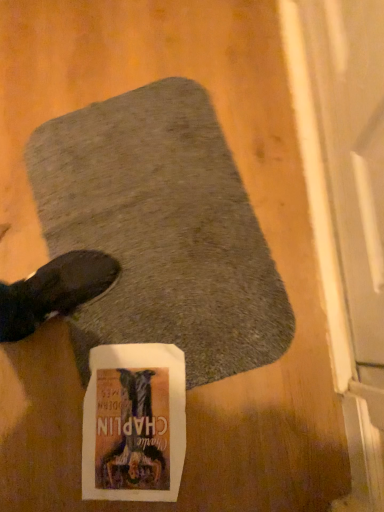
This screenshot has height=512, width=384. Describe the element at coordinates (161, 230) in the screenshot. I see `gray soft rug at center` at that location.

Locate an element on the screen. Image resolution: width=384 pixels, height=512 pixels. gray soft rug at center is located at coordinates (161, 230).

The image size is (384, 512). Find the location of `white paper flyer at center`. white paper flyer at center is located at coordinates pyautogui.click(x=134, y=423).

What do you see at coordinates (134, 423) in the screenshot? I see `white paper flyer at center` at bounding box center [134, 423].

The height and width of the screenshot is (512, 384). I want to click on gray soft rug at center, so click(x=161, y=230).

In the scene shown: Which object is positioned more to the right, gray soft rug at center or white paper flyer at center?

From the viewer's perspective, gray soft rug at center appears more on the right side.

Does gray soft rug at center come behind white paper flyer at center?

No, gray soft rug at center is in front of white paper flyer at center.

Is point (244, 340) in front of point (161, 445)?

That is False.

From the image's perspective, would you say gray soft rug at center is shown under white paper flyer at center?

Incorrect, from the image's perspective, gray soft rug at center is higher than white paper flyer at center.

From a real-world perspective, relative to white paper flyer at center, is gray soft rug at center vertically above or below?

gray soft rug at center is above white paper flyer at center.

Can you confirm if gray soft rug at center is wider than white paper flyer at center?

Yes, gray soft rug at center is wider than white paper flyer at center.

Considering the sizes of objects gray soft rug at center and white paper flyer at center in the image provided, who is shorter, gray soft rug at center or white paper flyer at center?

Standing shorter between the two is white paper flyer at center.

In terms of size, does gray soft rug at center appear bigger or smaller than white paper flyer at center?

Considering their sizes, gray soft rug at center takes up more space than white paper flyer at center.

Would you say gray soft rug at center is outside white paper flyer at center?

gray soft rug at center is positioned outside white paper flyer at center.

Is gray soft rug at center with white paper flyer at center?

gray soft rug at center and white paper flyer at center are clearly separated.

Does gray soft rug at center turn towards white paper flyer at center?

No.

How many degrees apart are the facing directions of gray soft rug at center and white paper flyer at center?

There is a 105-degree angle between the facing directions of gray soft rug at center and white paper flyer at center.

Locate an element on the screen. The image size is (384, 512). mat above the white paper flyer at center (from the image's perspective) is located at coordinates (161, 230).

Which is more to the right, white paper flyer at center or gray soft rug at center?

Positioned to the right is gray soft rug at center.

Considering the relative positions of white paper flyer at center and gray soft rug at center in the image provided, is white paper flyer at center behind gray soft rug at center?

Yes, it is behind gray soft rug at center.

Is point (117, 487) farther from viewer compared to point (254, 280)?

No, (117, 487) is closer to viewer.

From the image's perspective, is white paper flyer at center on top of gray soft rug at center?

No, from the image's perspective, white paper flyer at center is not above gray soft rug at center.

From a real-world perspective, which is physically above, white paper flyer at center or gray soft rug at center?

From a 3D spatial view, gray soft rug at center is above.

Which object is thinner, white paper flyer at center or gray soft rug at center?

Thinner between the two is white paper flyer at center.

Who is taller, white paper flyer at center or gray soft rug at center?

gray soft rug at center is taller.

Can you confirm if white paper flyer at center is smaller than gray soft rug at center?

Yes, white paper flyer at center is smaller than gray soft rug at center.

Is white paper flyer at center inside or outside of gray soft rug at center?

white paper flyer at center is located inside gray soft rug at center.

Does white paper flyer at center touch gray soft rug at center?

They are not placed beside each other.

Is gray soft rug at center at the back of white paper flyer at center?

No, white paper flyer at center's orientation is not away from gray soft rug at center.

Measure the distance from white paper flyer at center to gray soft rug at center.

white paper flyer at center is 22.08 centimeters from gray soft rug at center.

The height and width of the screenshot is (512, 384). Identify the location of mat on the right of white paper flyer at center. (161, 230).

This screenshot has width=384, height=512. I want to click on flyer behind the gray soft rug at center, so tap(134, 423).

There is a white paper flyer at center. In order to click on mat above it (from a real-world perspective) in this screenshot , I will do `click(161, 230)`.